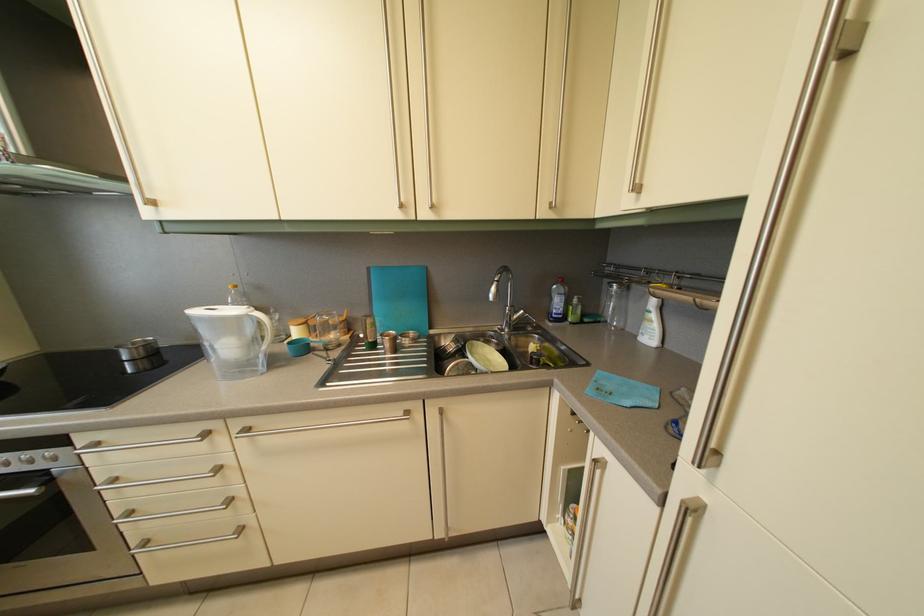
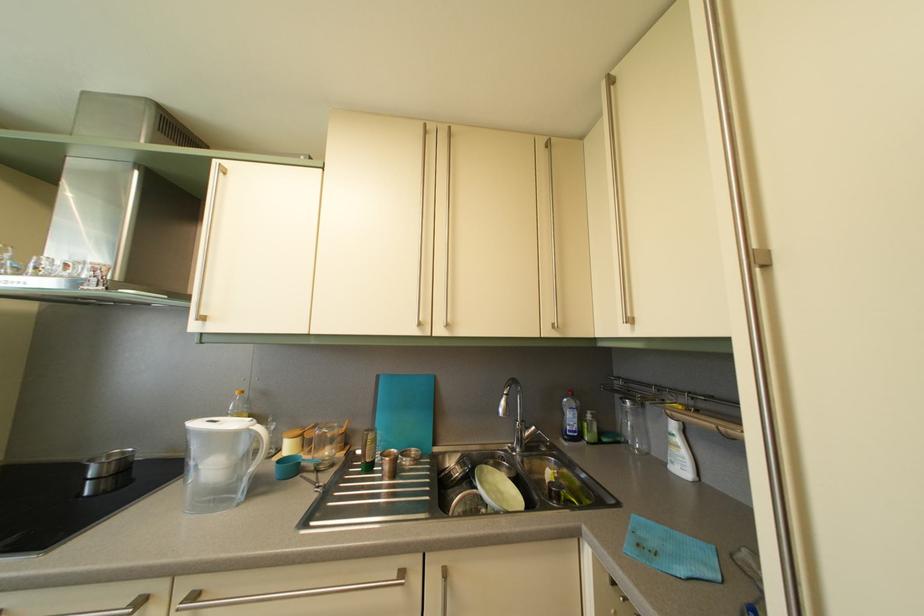
The point at (662, 323) is marked in the first image. Where is the corresponding point in the second image?

(687, 448)